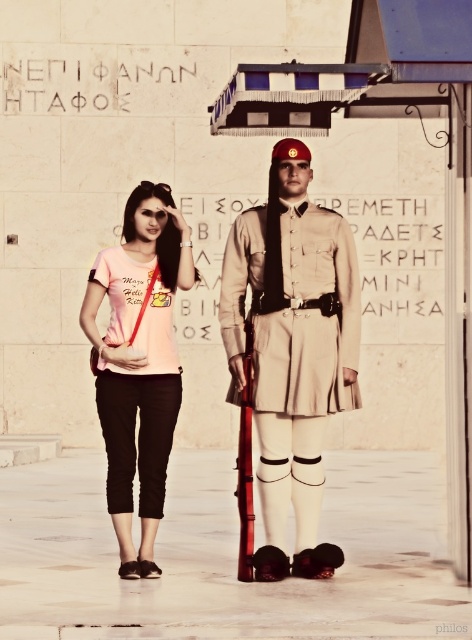
Which is more to the left, khaki uniform at center or pink matte t-shirt at center?

pink matte t-shirt at center

Can you confirm if khaki uniform at center is smaller than pink matte t-shirt at center?

No.

Identify the location of khaki uniform at center. The width and height of the screenshot is (472, 640). (292, 349).

Between point (87, 314) and point (246, 275), which one is positioned behind?

The point (246, 275) is behind.

Is point (133, 348) farther from camera compared to point (331, 320)?

That is False.

What do you see at coordinates (138, 362) in the screenshot? I see `pink matte t-shirt at center` at bounding box center [138, 362].

Identify the location of pink matte t-shirt at center. (138, 362).

Who is more forward, (340, 236) or (252, 208)?

Point (340, 236) is more forward.

Which is behind, point (327, 301) or point (232, 326)?

The point (327, 301) is more distant.

The image size is (472, 640). Identify the location of khaki uniform at center. (292, 349).